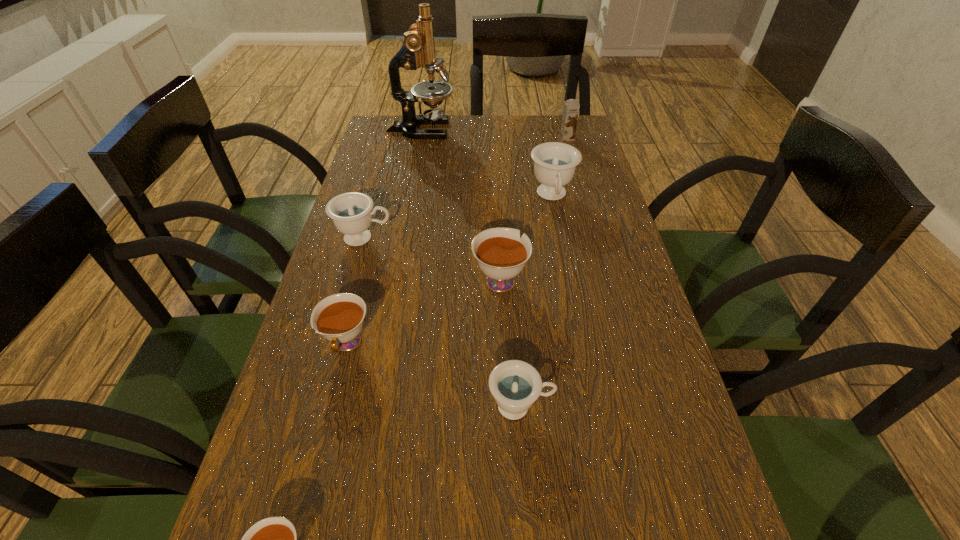
This screenshot has height=540, width=960. In order to click on vacant space positioned 0.270m on the side of the second biggest white teacup with the handle in this screenshot , I will do `click(302, 521)`.

Identify the location of vacant space located 0.210m on the side of the second blue teacup from left to right with the handle. The height and width of the screenshot is (540, 960). (667, 406).

I want to click on microscope that is at the far edge, so click(x=418, y=50).

This screenshot has width=960, height=540. Identify the location of chocolate milk that is at the far edge. (571, 107).

I want to click on microscope present at the left edge, so click(x=418, y=50).

You are a GUI agent. You are given a task and a screenshot of the screen. Output one action in this format:
    pyautogui.click(x=<x>, y=<y>)
    Task: Click on the chocolate milk at the right edge
    
    Given the screenshot: What is the action you would take?
    pyautogui.click(x=571, y=107)

This screenshot has height=540, width=960. I want to click on teacup that is at the right edge, so click(x=555, y=163).

Image resolution: width=960 pixels, height=540 pixels. I want to click on object at the far left corner, so click(418, 50).

Where is `object that is at the far right corner`? Image resolution: width=960 pixels, height=540 pixels. object that is at the far right corner is located at coordinates (x=571, y=107).

Where is `vacant space at the far edge of the desktop`? Image resolution: width=960 pixels, height=540 pixels. vacant space at the far edge of the desktop is located at coordinates click(x=468, y=123).